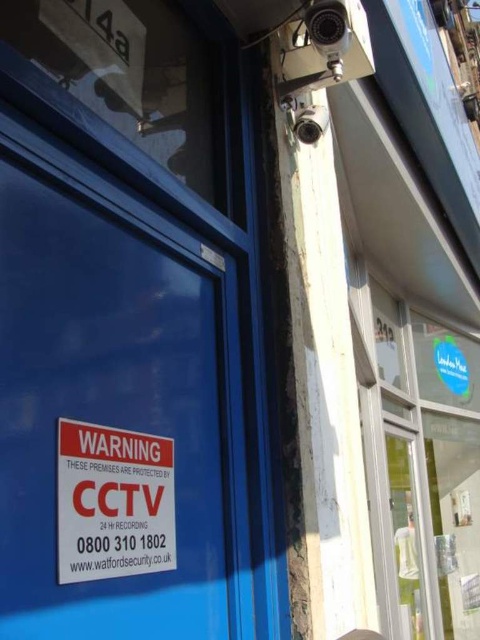
The height and width of the screenshot is (640, 480). What do you see at coordinates (106, 412) in the screenshot?
I see `blue matte sign at center` at bounding box center [106, 412].

Is point (104, 323) behind point (129, 452)?

Yes.

This screenshot has width=480, height=640. Describe the element at coordinates (106, 412) in the screenshot. I see `blue matte sign at center` at that location.

Where is `blue matte sign at center`? blue matte sign at center is located at coordinates (106, 412).